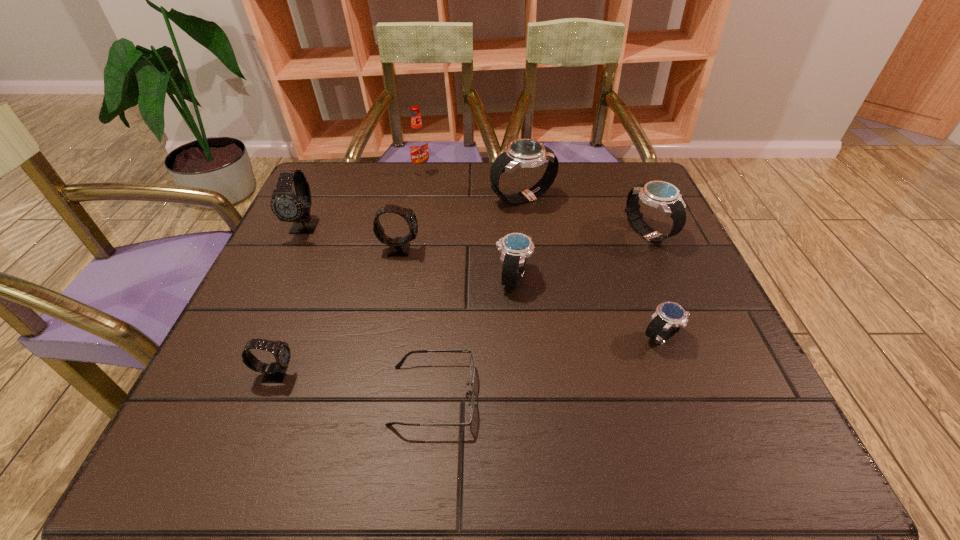
At what (x,y) coordinates should I click in order to perform the action: click on root beer. Please return your answer as a coordinate pair (x, y). Looking at the image, I should click on (418, 142).

You are a GUI agent. You are given a task and a screenshot of the screen. Output one action in this format:
    pyautogui.click(x=<x>, y=<y>)
    Task: Click on the red root beer
    The image size is (960, 540).
    Given the screenshot: What is the action you would take?
    pyautogui.click(x=418, y=142)

In order to click on the eighth nearest object in this screenshot , I will do `click(525, 153)`.

Where is `the farthest silver watch`? The width and height of the screenshot is (960, 540). the farthest silver watch is located at coordinates 525,153.

Image resolution: width=960 pixels, height=540 pixels. Identify the location of the biggest gray watch. 288,207.

Image resolution: width=960 pixels, height=540 pixels. What are the coordinates of `the second farthest silver watch` in the screenshot? It's located at (662, 195).

The image size is (960, 540). I want to click on the fifth watch from right to left, so click(x=399, y=247).

The image size is (960, 540). Find the location of `the second biggest gray watch`. the second biggest gray watch is located at coordinates (399, 247).

Find the location of a particular element. Image resolution: width=960 pixels, height=540 pixels. the fifth farthest watch is located at coordinates (515, 247).

The image size is (960, 540). I want to click on the sixth farthest object, so click(x=515, y=247).